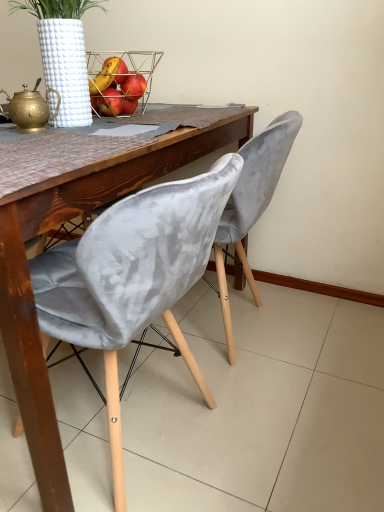
Question: From the image's perspective, is metallic wire basket at upper center positioned above or below velvet grey chair at center, acting as the second chair starting from the front?

Choices:
 (A) below
 (B) above

Answer: (B)

Question: In terms of width, does metallic wire basket at upper center look wider or thinner when compared to velvet grey chair at center, which is the 1th chair in back-to-front order?

Choices:
 (A) wide
 (B) thin

Answer: (B)

Question: Which is nearer to the velvet grey chair at center, positioned as the second chair in back-to-front order?

Choices:
 (A) metallic wire basket at upper center
 (B) velvet grey chair at center, which is the 1th chair in back-to-front order

Answer: (B)

Question: Estimate the real-world distances between objects in this image. Which object is farther from the metallic wire basket at upper center?

Choices:
 (A) velvet grey chair at center, positioned as the second chair in back-to-front order
 (B) velvet grey chair at center, acting as the second chair starting from the front

Answer: (A)